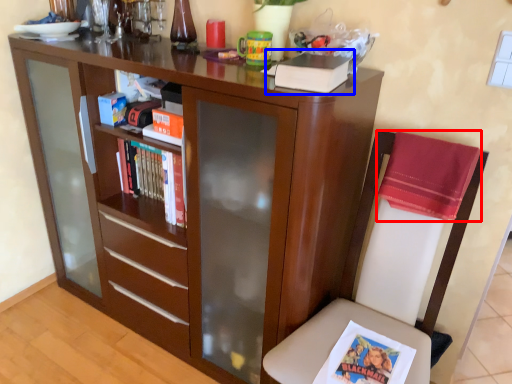
Question: Which object is further to the camera taking this photo, cloth (highlighted by a red box) or paperback book (highlighted by a blue box)?

Choices:
 (A) cloth
 (B) paperback book

Answer: (A)